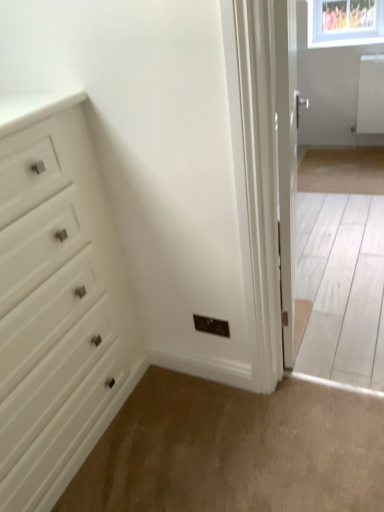
Describe the element at coordinates (288, 174) in the screenshot. The image size is (384, 512). I see `white glossy door at right` at that location.

Describe the element at coordinates (57, 302) in the screenshot. I see `white matte chest of drawers at left` at that location.

Where is `beige carpet at lower center`? Image resolution: width=384 pixels, height=512 pixels. beige carpet at lower center is located at coordinates (234, 450).

At what (x,y) coordinates should I click in order to perform the action: click on white glossy door at right. Please return your answer as a coordinate pair (x, y). The height and width of the screenshot is (512, 384). Looking at the image, I should click on (288, 174).

Would you say white glossy door at right is to the left or to the right of white matte chest of drawers at left in the picture?

In the image, white glossy door at right appears on the right side of white matte chest of drawers at left.

From the picture: Is white glossy door at right in contact with white matte chest of drawers at left?

white glossy door at right and white matte chest of drawers at left are clearly separated.

Which of these two, white glossy door at right or white matte chest of drawers at left, is thinner?

Thinner between the two is white glossy door at right.

Looking at this image, who is bigger, white glossy door at right or white matte chest of drawers at left?

With larger size is white matte chest of drawers at left.

Considering the positions of objects beige carpet at lower center and white matte chest of drawers at left in the image provided, who is more to the right, beige carpet at lower center or white matte chest of drawers at left?

beige carpet at lower center is more to the right.

Is beige carpet at lower center turned away from white matte chest of drawers at left?

No, beige carpet at lower center's orientation is not away from white matte chest of drawers at left.

How distant is beige carpet at lower center from white matte chest of drawers at left?

beige carpet at lower center is 20.73 inches away from white matte chest of drawers at left.

Is beige carpet at lower center bigger or smaller than white matte chest of drawers at left?

Considering their sizes, beige carpet at lower center takes up less space than white matte chest of drawers at left.

Is beige carpet at lower center inside or outside of white glossy door at right?

beige carpet at lower center cannot be found inside white glossy door at right.

Does beige carpet at lower center turn towards white glossy door at right?

No.

Is beige carpet at lower center bigger than white glossy door at right?

Actually, beige carpet at lower center might be smaller than white glossy door at right.

From the image's perspective, would you say beige carpet at lower center is shown under white glossy door at right?

Indeed, from the image's perspective, beige carpet at lower center is shown beneath white glossy door at right.

Considering the sizes of white glossy door at right and beige carpet at lower center in the image, is white glossy door at right wider or thinner than beige carpet at lower center?

Clearly, white glossy door at right has less width compared to beige carpet at lower center.

Is white glossy door at right directly adjacent to beige carpet at lower center?

No, white glossy door at right is not beside beige carpet at lower center.

How many degrees apart are the facing directions of white glossy door at right and beige carpet at lower center?

11.3 degrees.

Which is in front, point (282, 173) or point (248, 460)?

Positioned in front is point (282, 173).

Is white matte chest of drawers at left positioned far away from beige carpet at lower center?

No, white matte chest of drawers at left is not far from beige carpet at lower center.

Which of these two, white matte chest of drawers at left or beige carpet at lower center, stands taller?

With more height is white matte chest of drawers at left.

From the picture: Considering the positions of objects white matte chest of drawers at left and beige carpet at lower center in the image provided, who is more to the right, white matte chest of drawers at left or beige carpet at lower center?

beige carpet at lower center.

From a real-world perspective, relative to beige carpet at lower center, is white matte chest of drawers at left vertically above or below?

white matte chest of drawers at left is above beige carpet at lower center.

From their relative heights in the image, would you say white matte chest of drawers at left is taller or shorter than white glossy door at right?

Clearly, white matte chest of drawers at left is shorter compared to white glossy door at right.

Is white matte chest of drawers at left oriented away from white glossy door at right?

No, white matte chest of drawers at left is not facing the opposite direction of white glossy door at right.

Is point (73, 438) behind point (278, 81)?

Yes.

Find the location of `chest of drawers below the white glossy door at right (from a real-world perspective)`. chest of drawers below the white glossy door at right (from a real-world perspective) is located at coordinates (57, 302).

This screenshot has height=512, width=384. I want to click on plain to the right of white matte chest of drawers at left, so (x=234, y=450).

Estimate the real-world distances between objects in this image. Which object is closer to white glossy door at right, beige carpet at lower center or white matte chest of drawers at left?

beige carpet at lower center is closer to white glossy door at right.

Based on their spatial positions, is beige carpet at lower center or white glossy door at right closer to white matte chest of drawers at left?

beige carpet at lower center lies closer to white matte chest of drawers at left than the other object.

Estimate the real-world distances between objects in this image. Which object is closer to white glossy door at right, white matte chest of drawers at left or beige carpet at lower center?

Among the two, beige carpet at lower center is located nearer to white glossy door at right.

Based on the photo, which object lies nearer to the anchor point white matte chest of drawers at left, white glossy door at right or beige carpet at lower center?

beige carpet at lower center lies closer to white matte chest of drawers at left than the other object.

Considering their positions, is white glossy door at right positioned further to beige carpet at lower center than white matte chest of drawers at left?

Based on the image, white glossy door at right appears to be further to beige carpet at lower center.

When comparing their distances from beige carpet at lower center, does white matte chest of drawers at left or white glossy door at right seem closer?

white matte chest of drawers at left.

In order to click on plain between white matte chest of drawers at left and white glossy door at right in this screenshot , I will do `click(234, 450)`.